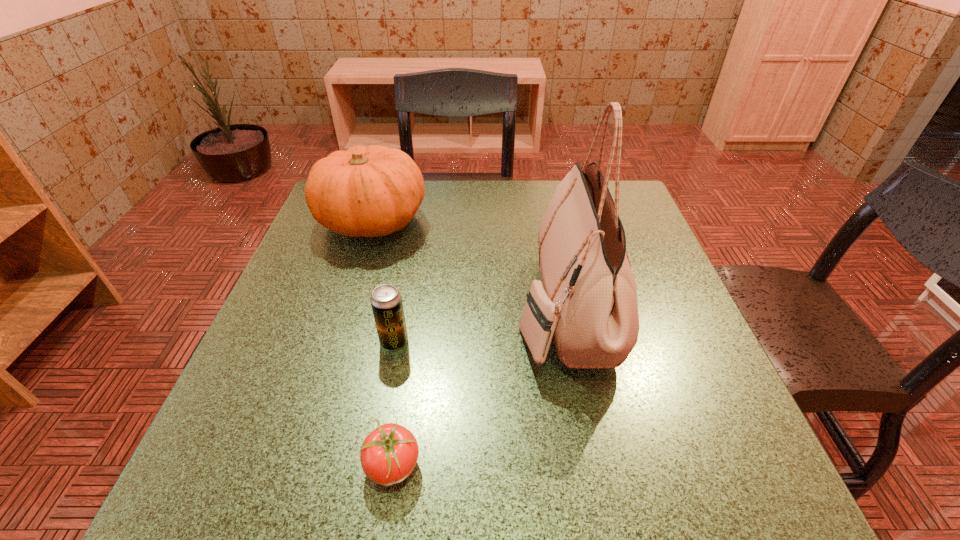
Locate an element on the screen. the rightmost object is located at coordinates (586, 300).

I want to click on handbag, so click(586, 300).

I want to click on the second tallest object, so click(x=373, y=191).

Find the location of a particular element. beer can is located at coordinates (386, 301).

In order to click on tomato in this screenshot , I will do `click(388, 455)`.

Where is `the nearest object`? This screenshot has width=960, height=540. the nearest object is located at coordinates (388, 455).

Locate an element on the screen. The height and width of the screenshot is (540, 960). free region located 0.090m on the side of the rightmost object with the attached pouch is located at coordinates (472, 307).

I want to click on vacant space positioned on the side of the rightmost object with the attached pouch, so click(482, 307).

You are a GUI agent. You are given a task and a screenshot of the screen. Output one action in this format:
    pyautogui.click(x=<x>, y=<y>)
    Task: Click on the vacant space located 0.120m on the side of the rightmost object with the attached pouch
    
    Given the screenshot: What is the action you would take?
    pyautogui.click(x=457, y=307)

I want to click on blank area located on the front of the pumpkin, so click(x=354, y=278).